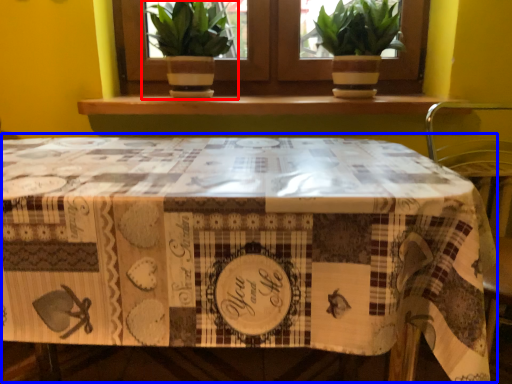
Question: Which object is further to the camera taking this photo, houseplant (highlighted by a red box) or table (highlighted by a blue box)?

Choices:
 (A) houseplant
 (B) table

Answer: (A)